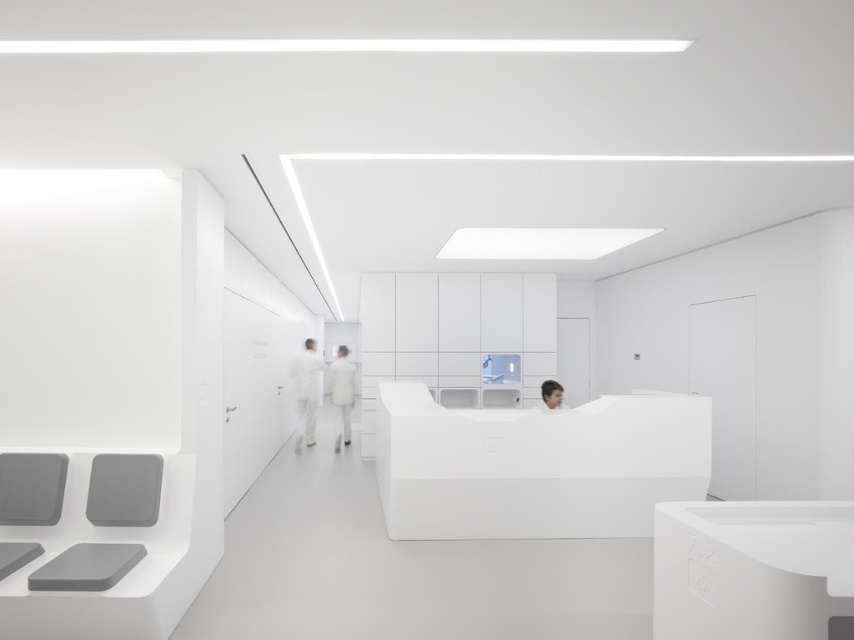
You are standing at the entrance of the office and see the point marked at coordinates (124, 490). What object is located at that position?

The point at coordinates (124, 490) corresponds to the matte gray chair at lower left.

You are standing at the entrance of the office and want to move towards the two points marked in the room. Which point, point (107, 468) or point (306, 420), will you reach first?

Point (107, 468) is closer to the viewer than point (306, 420), so you will reach point (107, 468) first.

You are a patient entering the office and need to locate the receptionist. You see the white matte uniform at center and the smooth black hair at center. Which object is closer to your eye level?

The white matte uniform at center is taller than the smooth black hair at center, so the white matte uniform at center is closer to your eye level.